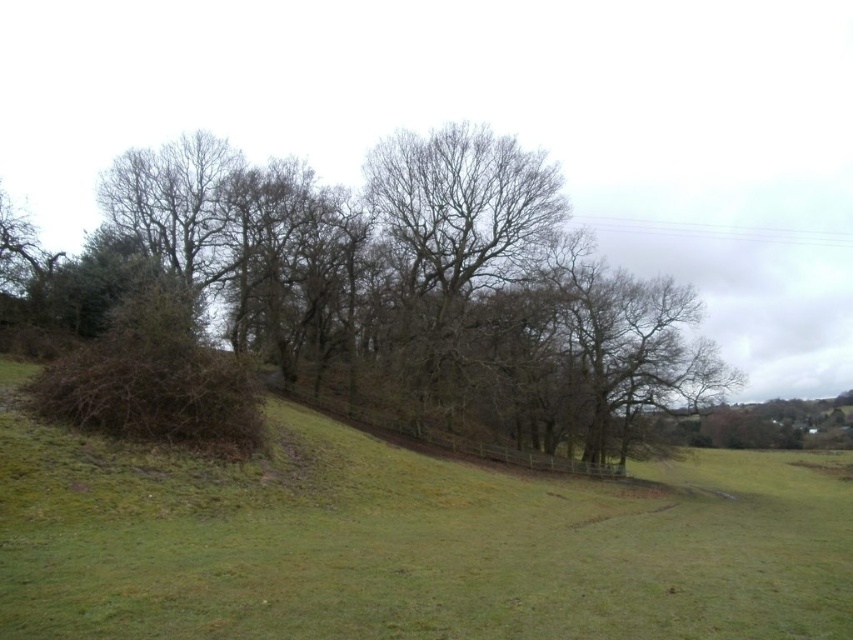
Which is in front, point (158, 252) or point (253, 545)?

Point (253, 545)

Find the location of a particular element. This screenshot has width=853, height=640. bare branches at center is located at coordinates (364, 305).

Find the location of `bare branches at center`. bare branches at center is located at coordinates (364, 305).